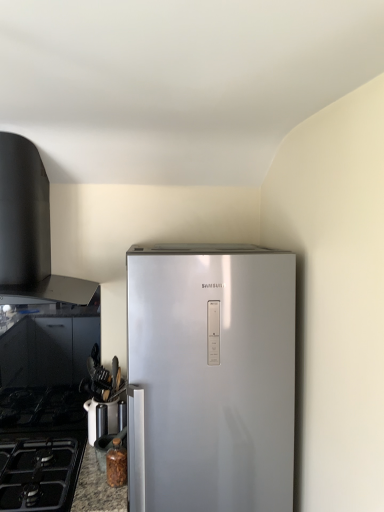
Question: From a real-world perspective, is black matte gas stove at lower left positioned above or below black matte vent at upper left?

Choices:
 (A) above
 (B) below

Answer: (B)

Question: Looking at the image, does black matte gas stove at lower left seem bigger or smaller compared to black matte vent at upper left?

Choices:
 (A) big
 (B) small

Answer: (B)

Question: Which of these objects is positioned closest to the metallic silver knife block at lower left?

Choices:
 (A) granite countertop at lower left
 (B) black matte gas stove at lower left
 (C) black matte vent at upper left

Answer: (A)

Question: Considering the real-world distances, which object is farthest from the black matte gas stove at lower left?

Choices:
 (A) black matte vent at upper left
 (B) granite countertop at lower left
 (C) metallic silver knife block at lower left

Answer: (A)